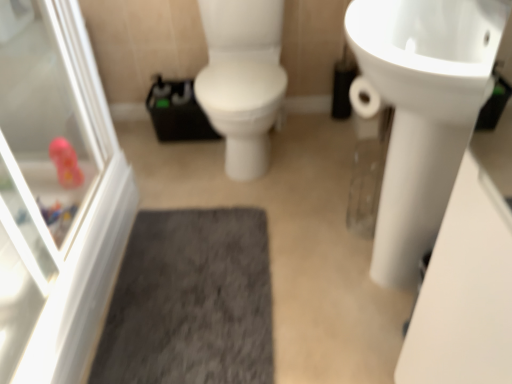
The height and width of the screenshot is (384, 512). What do you see at coordinates (423, 110) in the screenshot?
I see `white glossy sink at upper right` at bounding box center [423, 110].

Image resolution: width=512 pixels, height=384 pixels. In order to click on gray shaggy bath mat at center in this screenshot , I will do `click(191, 301)`.

Where is `white glossy screen door at left`? The image size is (512, 384). white glossy screen door at left is located at coordinates (55, 194).

Is white glossy screen door at left a part of white glossy sink at upper right?

No, white glossy sink at upper right does not contain white glossy screen door at left.

From the image's perspective, is white glossy sink at upper right located beneath white glossy screen door at left?

No, from the image's perspective, white glossy sink at upper right is not below white glossy screen door at left.

Image resolution: width=512 pixels, height=384 pixels. Find the location of `screen door that appears in front of the white glossy sink at upper right`. screen door that appears in front of the white glossy sink at upper right is located at coordinates (55, 194).

Consider the image. Is white glossy sink at upper right looking in the opposite direction of white glossy screen door at left?

No, white glossy sink at upper right is not facing away from white glossy screen door at left.

I want to click on bath mat that is below the white glossy sink at upper right (from the image's perspective), so click(x=191, y=301).

Is point (391, 213) farther from camera compared to point (165, 313)?

No, it is not.

Who is smaller, white glossy sink at upper right or gray shaggy bath mat at center?

Smaller between the two is gray shaggy bath mat at center.

Between white glossy sink at upper right and gray shaggy bath mat at center, which one is positioned behind?

gray shaggy bath mat at center is behind.

In the image, is white glossy screen door at left positioned in front of or behind gray shaggy bath mat at center?

white glossy screen door at left is positioned closer to the viewer than gray shaggy bath mat at center.

Is white glossy screen door at left wider than gray shaggy bath mat at center?

No, white glossy screen door at left is not wider than gray shaggy bath mat at center.

Considering the sizes of white glossy screen door at left and gray shaggy bath mat at center in the image, is white glossy screen door at left taller or shorter than gray shaggy bath mat at center?

In the image, white glossy screen door at left appears to be taller than gray shaggy bath mat at center.

At what (x,y) coordinates should I click in order to perform the action: click on screen door above the gray shaggy bath mat at center (from the image's perspective). Please return your answer as a coordinate pair (x, y). Looking at the image, I should click on (55, 194).

From their relative heights in the image, would you say gray shaggy bath mat at center is taller or shorter than white glossy sink at upper right?

gray shaggy bath mat at center is shorter than white glossy sink at upper right.

Based on their sizes in the image, would you say gray shaggy bath mat at center is bigger or smaller than white glossy sink at upper right?

Considering their sizes, gray shaggy bath mat at center takes up less space than white glossy sink at upper right.

Is white glossy sink at upper right completely or partially inside gray shaggy bath mat at center?

No, white glossy sink at upper right is not inside gray shaggy bath mat at center.

Is white glossy screen door at left inside the boundaries of white glossy sink at upper right, or outside?

white glossy screen door at left lies outside white glossy sink at upper right.

Considering the points (66, 302) and (424, 147), which point is in front, point (66, 302) or point (424, 147)?

Point (424, 147)

Relative to white glossy sink at upper right, is white glossy screen door at left in front or behind?

Clearly, white glossy screen door at left is in front of white glossy sink at upper right.

From the image's perspective, is white glossy screen door at left on top of white glossy sink at upper right?

No.

From the image's perspective, is gray shaggy bath mat at center located beneath white glossy screen door at left?

Yes, from the image's perspective, gray shaggy bath mat at center is below white glossy screen door at left.

Which of these two, gray shaggy bath mat at center or white glossy screen door at left, is bigger?

Bigger between the two is white glossy screen door at left.

From a real-world perspective, which object rests below the other?

gray shaggy bath mat at center.

The width and height of the screenshot is (512, 384). Identify the location of screen door that is below the white glossy sink at upper right (from the image's perspective). (55, 194).

In the image, there is a gray shaggy bath mat at center. Where is `sink above it (from the image's perspective)`? Image resolution: width=512 pixels, height=384 pixels. sink above it (from the image's perspective) is located at coordinates (423, 110).

Looking at the image, which one is located further to white glossy screen door at left, white glossy sink at upper right or gray shaggy bath mat at center?

Based on the image, white glossy sink at upper right appears to be further to white glossy screen door at left.

When comparing their distances from white glossy sink at upper right, does gray shaggy bath mat at center or white glossy screen door at left seem further?

Among the two, white glossy screen door at left is located further to white glossy sink at upper right.

From the image, which object appears to be nearer to white glossy sink at upper right, white glossy screen door at left or gray shaggy bath mat at center?

gray shaggy bath mat at center is closer to white glossy sink at upper right.

Looking at the image, which one is located further to gray shaggy bath mat at center, white glossy sink at upper right or white glossy screen door at left?

white glossy sink at upper right is further to gray shaggy bath mat at center.

From the image, which object appears to be farther from gray shaggy bath mat at center, white glossy screen door at left or white glossy sink at upper right?

white glossy sink at upper right lies further to gray shaggy bath mat at center than the other object.

Based on their spatial positions, is gray shaggy bath mat at center or white glossy sink at upper right closer to white glossy screen door at left?

gray shaggy bath mat at center.

The height and width of the screenshot is (384, 512). Find the location of `bath mat situated between white glossy screen door at left and white glossy sink at upper right from left to right`. bath mat situated between white glossy screen door at left and white glossy sink at upper right from left to right is located at coordinates (191, 301).